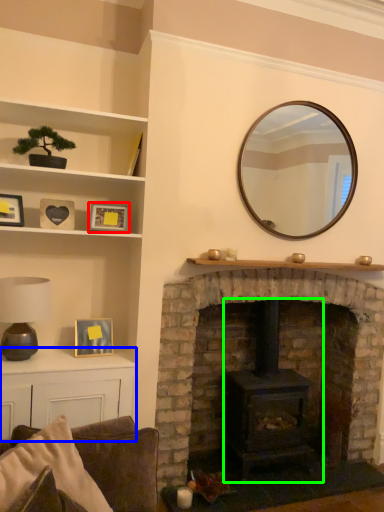
Question: Based on their relative distances, which object is nearer to picture frame (highlighted by a red box)? Choose from table (highlighted by a blue box) and wood burning stove (highlighted by a green box).

Choices:
 (A) table
 (B) wood burning stove

Answer: (A)